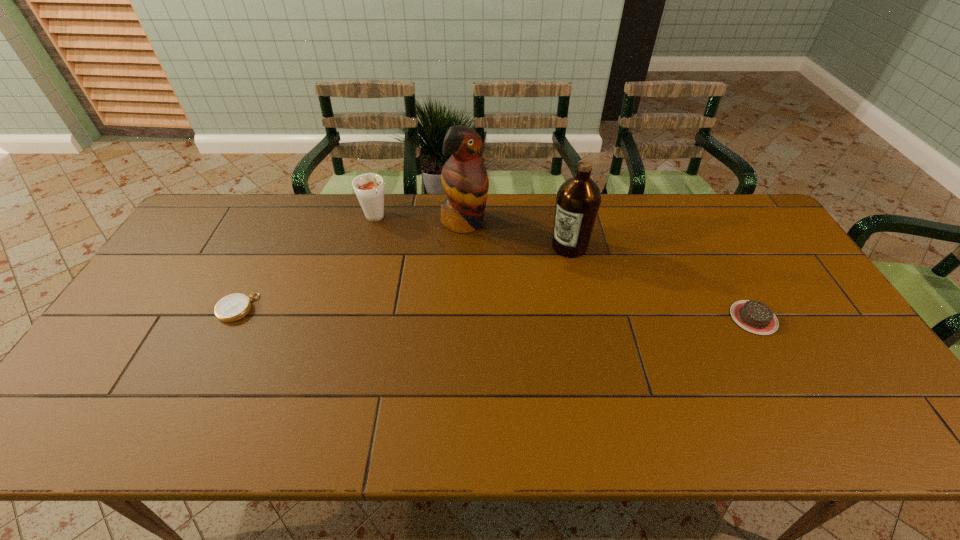
Image resolution: width=960 pixels, height=540 pixels. I want to click on unoccupied area between the chocolate cake and the shortest object, so click(495, 313).

What are the coordinates of `free area in between the rightmost object and the parrot` in the screenshot? It's located at (609, 270).

Identify the location of free space between the second shortest object and the root beer. (564, 268).

Where is `vacant space that's between the third object from right to left and the leftmost object`? The image size is (960, 540). vacant space that's between the third object from right to left and the leftmost object is located at coordinates (350, 265).

Find the location of a particular element. empty location between the tallest object and the compass is located at coordinates (350, 265).

The width and height of the screenshot is (960, 540). Identify the location of vacant region between the olive oil and the parrot. (516, 234).

This screenshot has height=540, width=960. In order to click on unoccupied area between the fourth object from right to left and the third object from right to left in this screenshot , I will do `click(420, 220)`.

Image resolution: width=960 pixels, height=540 pixels. I want to click on free spot between the olive oil and the fourth tallest object, so click(661, 282).

Identify the location of empty location between the third shortest object and the second object from right to left. The image size is (960, 540). (472, 232).

This screenshot has height=540, width=960. Find the location of `vacant space in between the tallest object and the fourth object from left to right`. vacant space in between the tallest object and the fourth object from left to right is located at coordinates (516, 234).